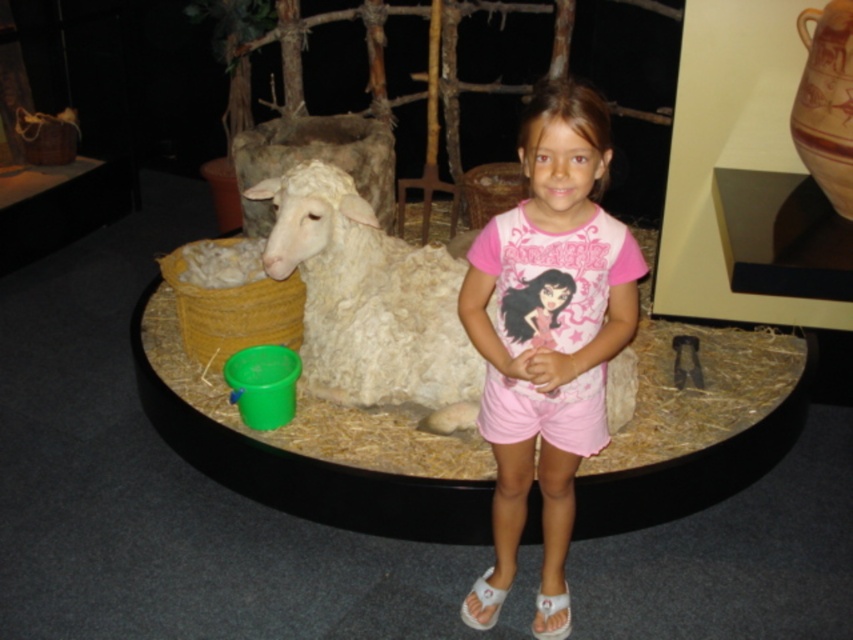
Does pink cotton shorts at center appear on the left side of white woolen sheep at center?

No, pink cotton shorts at center is not to the left of white woolen sheep at center.

Which is above, pink cotton shorts at center or white woolen sheep at center?

Positioned higher is white woolen sheep at center.

The height and width of the screenshot is (640, 853). Describe the element at coordinates (547, 337) in the screenshot. I see `pink cotton shorts at center` at that location.

This screenshot has height=640, width=853. What are the coordinates of `pink cotton shorts at center` in the screenshot? It's located at (547, 337).